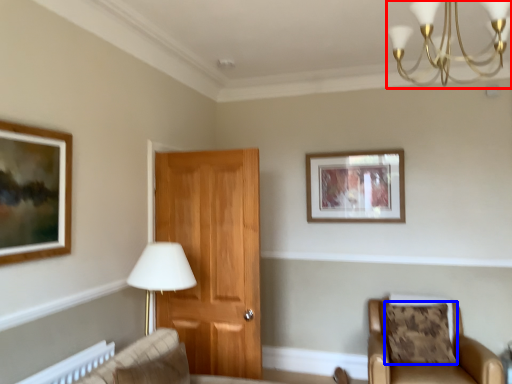
Question: Among these objects, which one is farthest to the camera, light fixture (highlighted by a red box) or pillow (highlighted by a blue box)?

Choices:
 (A) light fixture
 (B) pillow

Answer: (B)